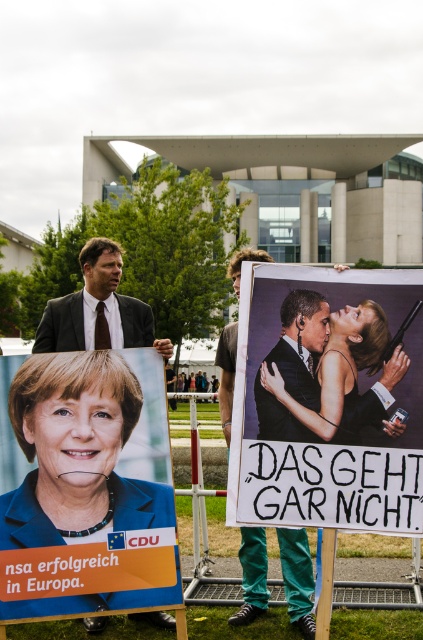
You are a photographer at the protest scene. You need to capture a photo that includes both the matte black poster at center and the matte black suit at center. Based on their positions, which object should appear higher in the photo?

The matte black poster at center is above the matte black suit at center, so it will naturally appear higher in the photo.

You are a photographer at the protest scene. You need to capture a photo where both the matte black poster at center and the smooth skin woman at center are clearly visible. Given their height difference, which object should you focus on to ensure both are in frame without cropping?

The matte black poster at center is taller than the smooth skin woman at center, so focusing on the poster will ensure the woman is also in frame since she is shorter.